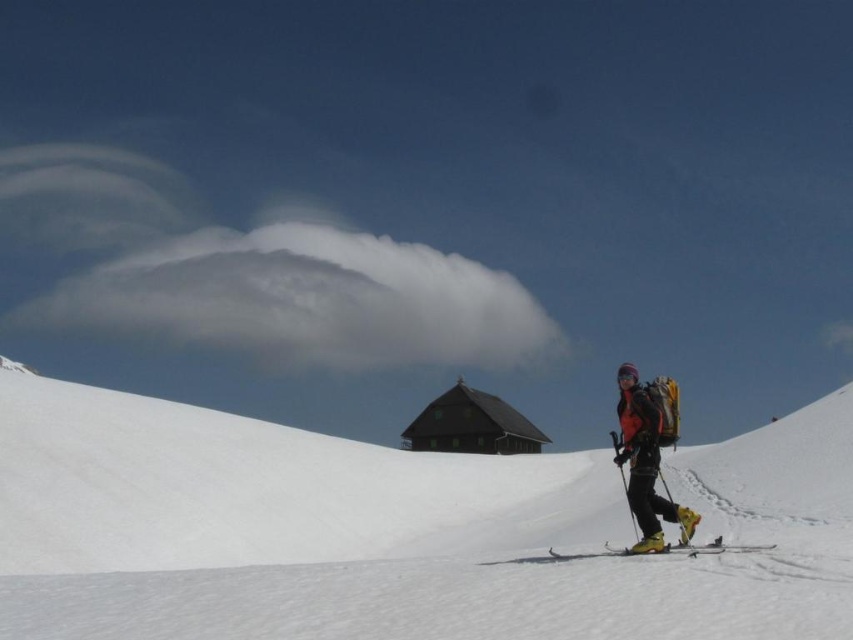
You are a photographer trying to capture the orange fabric jacket at right and the dark brown wooden hut at center in the same frame. Based on their positions, can you determine if the jacket is closer to you than the hut?

The orange fabric jacket at right is located above the dark brown wooden hut at center, which suggests that the jacket is closer to you since objects closer to the viewer appear higher in the frame.

You are a drone operator trying to capture a photo of the white fluffy cloud at upper center while avoiding the white powder snow at center. Given the distance between them, is it feasible to adjust the drone to focus on the cloud without the snow appearing in the frame?

The distance between the white powder snow at center and the white fluffy cloud at upper center is 568.61 feet. Since the cloud is much farther away, adjusting the drone to focus on the cloud would likely exclude the snow from the frame as they are separated by a significant distance.